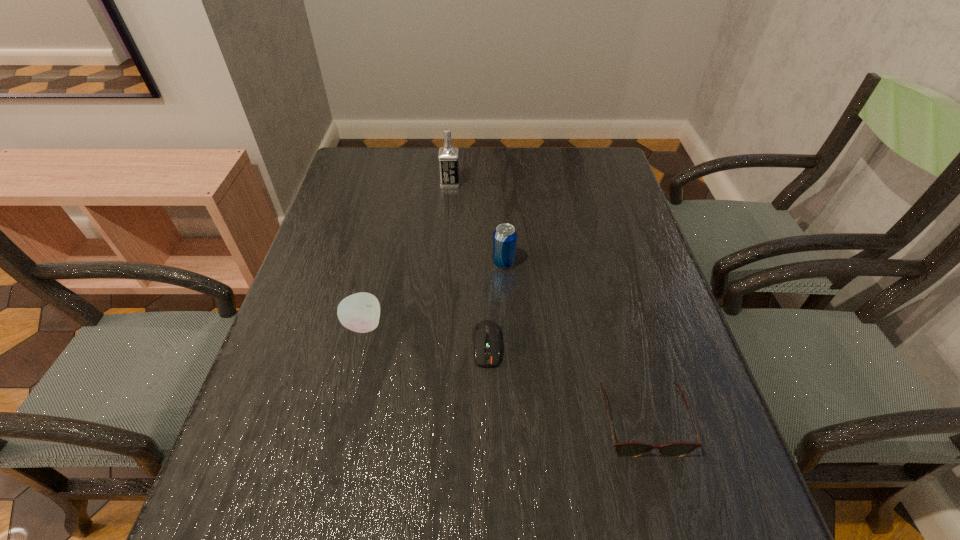
Identify the location of vodka. The image size is (960, 540). (448, 155).

Identify the location of the tallest object. The height and width of the screenshot is (540, 960). (448, 155).

What are the coordinates of `the second farthest object` in the screenshot? It's located at (505, 236).

Locate an element on the screen. The image size is (960, 540). beer can is located at coordinates (505, 236).

This screenshot has width=960, height=540. I want to click on apple, so click(360, 312).

The width and height of the screenshot is (960, 540). I want to click on the third tallest object, so click(360, 312).

Where is `the fourth tallest object`? The height and width of the screenshot is (540, 960). the fourth tallest object is located at coordinates (627, 449).

Find the location of a particular element. The image size is (960, 540). the nearest object is located at coordinates (627, 449).

The height and width of the screenshot is (540, 960). Find the location of `the shortest object`. the shortest object is located at coordinates (486, 334).

You are a GUI agent. You are given a task and a screenshot of the screen. Output one action in this format:
    pyautogui.click(x=<x>, y=<y>)
    Task: Click on the vacant area located on the front label of the second object from left to right
    The image size is (960, 540).
    Given the screenshot: What is the action you would take?
    pyautogui.click(x=489, y=184)